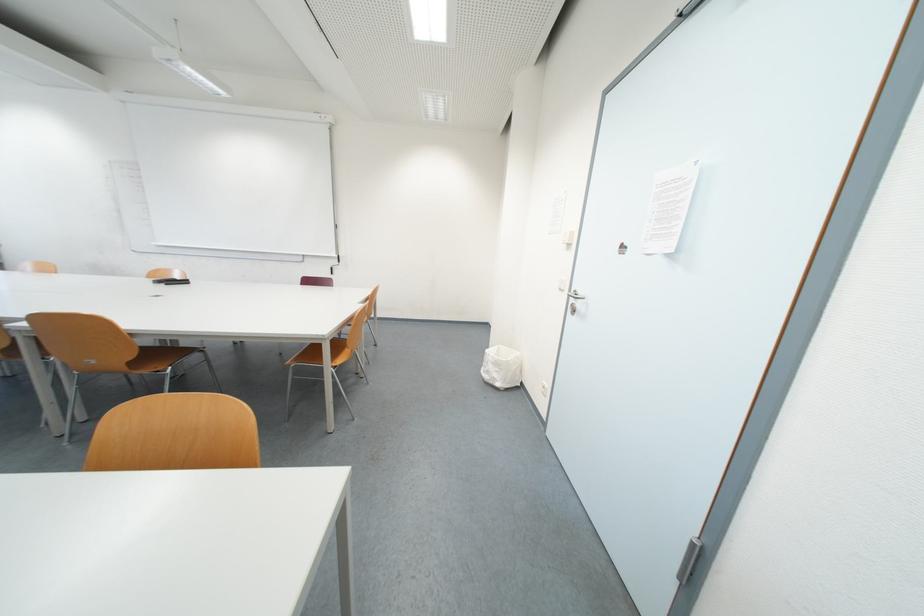
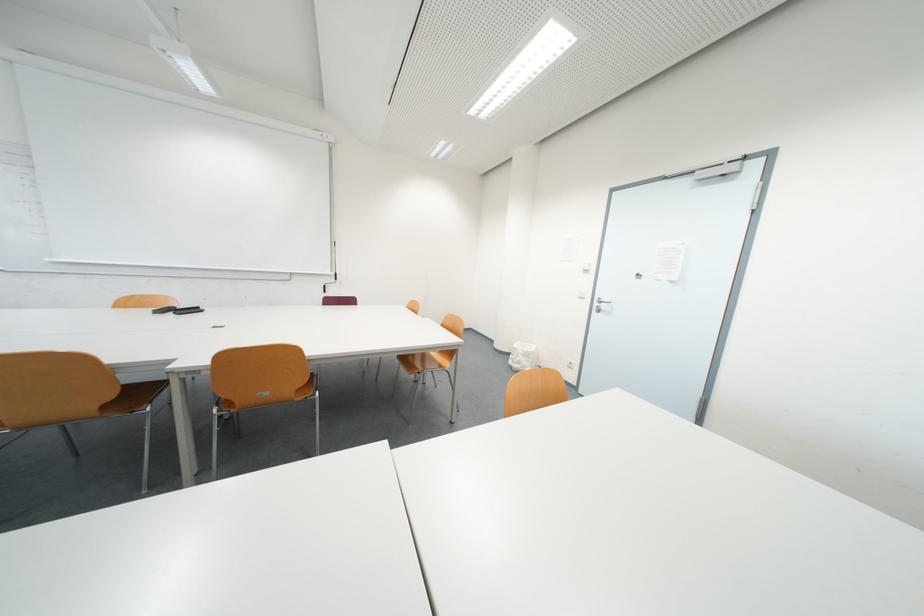
Question: The images are taken continuously from a first-person perspective. In which direction are you moving?

Choices:
 (A) Left
 (B) Right
 (C) Forward
 (D) Backward

Answer: (A)